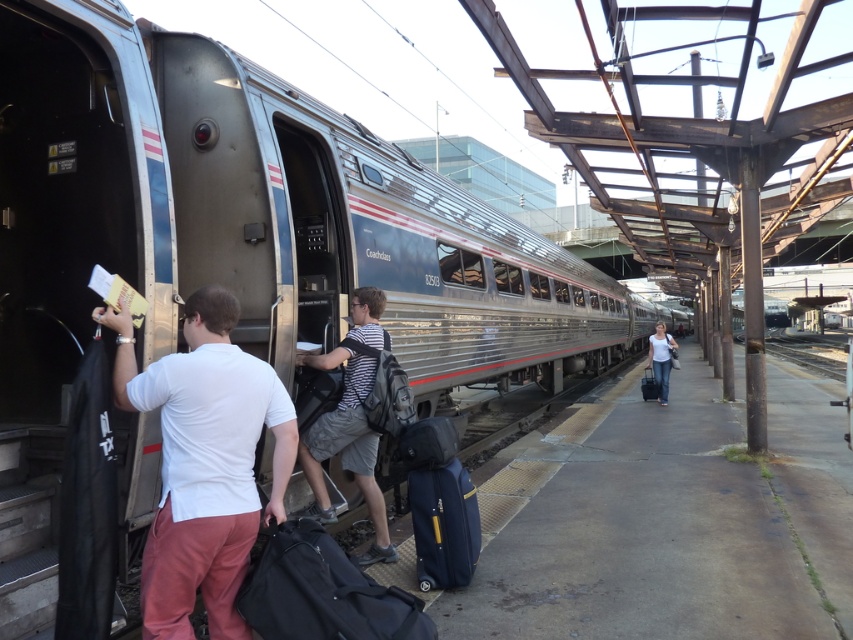
Question: Does white matte shirt at left appear on the left side of striped cotton shirt at center?

Choices:
 (A) no
 (B) yes

Answer: (B)

Question: Does striped cotton shirt at center have a larger size compared to matte black suitcase at right?

Choices:
 (A) no
 (B) yes

Answer: (B)

Question: Which of these objects is positioned farthest from the white matte shirt at left?

Choices:
 (A) black fabric duffel bag at lower center
 (B) white cotton shirt at center
 (C) striped cotton shirt at center
 (D) matte black suitcase at right

Answer: (D)

Question: Among these objects, which one is farthest from the camera?

Choices:
 (A) black fabric duffel bag at lower center
 (B) white cotton shirt at center
 (C) matte black suitcase at right

Answer: (C)

Question: Among these objects, which one is nearest to the camera?

Choices:
 (A) matte black suitcase at right
 (B) blue fabric suitcase at lower center
 (C) white matte shirt at left

Answer: (C)

Question: Considering the relative positions of blue fabric suitcase at lower center and matte black suitcase at right in the image provided, where is blue fabric suitcase at lower center located with respect to matte black suitcase at right?

Choices:
 (A) right
 (B) left

Answer: (B)